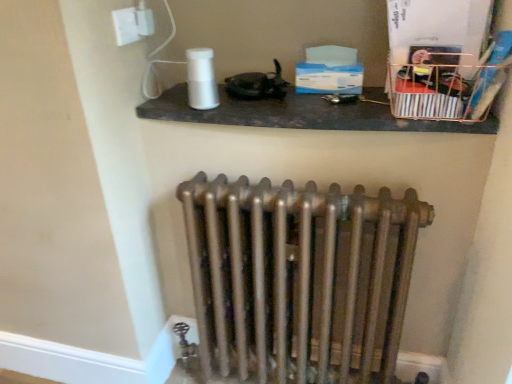
Identify the location of white glossy electric outlet at upper left. (132, 23).

What do you see at coordinates (298, 280) in the screenshot?
I see `bronze metallic radiator at center` at bounding box center [298, 280].

Locate an element on the screen. white glossy electric outlet at upper left is located at coordinates (132, 23).

Locate an element on the screen. This screenshot has height=384, width=512. radiator in front of the white glossy shelf at upper center is located at coordinates (298, 280).

Consider the image. Which is more to the left, white glossy shelf at upper center or bronze metallic radiator at center?

bronze metallic radiator at center.

Is white glossy shelf at upper center situated inside bronze metallic radiator at center or outside?

The correct answer is: outside.

Is white glossy shelf at upper center beside bronze metallic radiator at center?

white glossy shelf at upper center is not next to bronze metallic radiator at center, and they're not touching.

In the scene shown: Is bronze metallic radiator at center located outside white glossy electric outlet at upper left?

bronze metallic radiator at center is positioned outside white glossy electric outlet at upper left.

From a real-world perspective, which object stands above the other?

white glossy electric outlet at upper left, from a real-world perspective.

Who is taller, bronze metallic radiator at center or white glossy electric outlet at upper left?

With more height is bronze metallic radiator at center.

Does point (488, 87) appear closer or farther from the camera than point (124, 34)?

Point (488, 87) appears to be closer to the viewer than point (124, 34).

Is metallic wire basket at upper right smaller than white glossy electric outlet at upper left?

No.

Considering the positions of objects metallic wire basket at upper right and white glossy electric outlet at upper left in the image provided, who is more to the left, metallic wire basket at upper right or white glossy electric outlet at upper left?

From the viewer's perspective, white glossy electric outlet at upper left appears more on the left side.

In terms of width, does metallic wire basket at upper right look wider or thinner when compared to white glossy electric outlet at upper left?

In the image, metallic wire basket at upper right appears to be wider than white glossy electric outlet at upper left.

Does white glossy shelf at upper center lie in front of white glossy electric outlet at upper left?

Yes, the depth of white glossy shelf at upper center is less than that of white glossy electric outlet at upper left.

Could you measure the distance between white glossy shelf at upper center and white glossy electric outlet at upper left?

white glossy shelf at upper center and white glossy electric outlet at upper left are 15.88 inches apart from each other.

Is white glossy shelf at upper center inside the boundaries of white glossy electric outlet at upper left, or outside?

white glossy shelf at upper center is not enclosed by white glossy electric outlet at upper left.

How different are the orientations of white glossy shelf at upper center and white glossy electric outlet at upper left in degrees?

white glossy shelf at upper center and white glossy electric outlet at upper left are facing 89.8 degrees away from each other.

The width and height of the screenshot is (512, 384). I want to click on crate located on the right of white glossy electric outlet at upper left, so click(442, 86).

Does white glossy electric outlet at upper left have a lesser height compared to metallic wire basket at upper right?

Yes.

Considering the positions of points (121, 41) and (457, 56), is point (121, 41) closer to camera compared to point (457, 56)?

No, (121, 41) is behind (457, 56).

In the image, is white glossy electric outlet at upper left positioned in front of or behind metallic wire basket at upper right?

Visually, white glossy electric outlet at upper left is located behind metallic wire basket at upper right.

Which object is positioned more to the right, metallic wire basket at upper right or bronze metallic radiator at center?

From the viewer's perspective, metallic wire basket at upper right appears more on the right side.

From the image's perspective, is metallic wire basket at upper right positioned above or below bronze metallic radiator at center?

From the image's perspective, metallic wire basket at upper right appears above bronze metallic radiator at center.

From a real-world perspective, relative to bronze metallic radiator at center, is metallic wire basket at upper right vertically above or below?

Clearly, from a real-world perspective, metallic wire basket at upper right is above bronze metallic radiator at center.

In the scene shown: Considering the sizes of objects metallic wire basket at upper right and bronze metallic radiator at center in the image provided, who is thinner, metallic wire basket at upper right or bronze metallic radiator at center?

With smaller width is bronze metallic radiator at center.

Would you say white glossy electric outlet at upper left is inside or outside white glossy shelf at upper center?

white glossy electric outlet at upper left exists outside the volume of white glossy shelf at upper center.

Where is `shelf below the white glossy electric outlet at upper left (from the image's perspective)`? The width and height of the screenshot is (512, 384). shelf below the white glossy electric outlet at upper left (from the image's perspective) is located at coordinates (298, 114).

From a real-world perspective, is white glossy electric outlet at upper left physically located above or below white glossy shelf at upper center?

white glossy electric outlet at upper left is situated higher than white glossy shelf at upper center in the real world.

Who is taller, white glossy electric outlet at upper left or white glossy shelf at upper center?

With more height is white glossy electric outlet at upper left.

In the image, there is a white glossy shelf at upper center. Where is `radiator below it (from the image's perspective)`? The height and width of the screenshot is (384, 512). radiator below it (from the image's perspective) is located at coordinates (298, 280).

Where is `radiator in front of the white glossy electric outlet at upper left`? radiator in front of the white glossy electric outlet at upper left is located at coordinates (298, 280).

Looking at the image, which one is located further to white glossy electric outlet at upper left, metallic wire basket at upper right or white glossy shelf at upper center?

The object further to white glossy electric outlet at upper left is metallic wire basket at upper right.

From the picture: From the image, which object appears to be nearer to bronze metallic radiator at center, metallic wire basket at upper right or white glossy electric outlet at upper left?

Based on the image, metallic wire basket at upper right appears to be nearer to bronze metallic radiator at center.

When comparing their distances from metallic wire basket at upper right, does bronze metallic radiator at center or white glossy electric outlet at upper left seem further?

Based on the image, white glossy electric outlet at upper left appears to be further to metallic wire basket at upper right.

From the image, which object appears to be nearer to metallic wire basket at upper right, white glossy shelf at upper center or white glossy electric outlet at upper left?

white glossy shelf at upper center is positioned closer to the anchor metallic wire basket at upper right.

Which object lies further to the anchor point white glossy shelf at upper center, white glossy electric outlet at upper left or bronze metallic radiator at center?

bronze metallic radiator at center lies further to white glossy shelf at upper center than the other object.

Estimate the real-world distances between objects in this image. Which object is further from metallic wire basket at upper right, white glossy shelf at upper center or bronze metallic radiator at center?

bronze metallic radiator at center.

Which object lies further to the anchor point white glossy electric outlet at upper left, metallic wire basket at upper right or bronze metallic radiator at center?

bronze metallic radiator at center.

Which object lies nearer to the anchor point white glossy electric outlet at upper left, bronze metallic radiator at center or white glossy shelf at upper center?

Based on the image, white glossy shelf at upper center appears to be nearer to white glossy electric outlet at upper left.

Find the location of a particular element. The image size is (512, 384). shelf between white glossy electric outlet at upper left and metallic wire basket at upper right is located at coordinates (298, 114).

What are the coordinates of `shelf between white glossy electric outlet at upper left and bronze metallic radiator at center vertically` in the screenshot? It's located at (298, 114).

Locate an element on the screen. The image size is (512, 384). crate that lies between white glossy electric outlet at upper left and bronze metallic radiator at center from top to bottom is located at coordinates (442, 86).

This screenshot has height=384, width=512. I want to click on shelf between metallic wire basket at upper right and bronze metallic radiator at center in the vertical direction, so click(x=298, y=114).